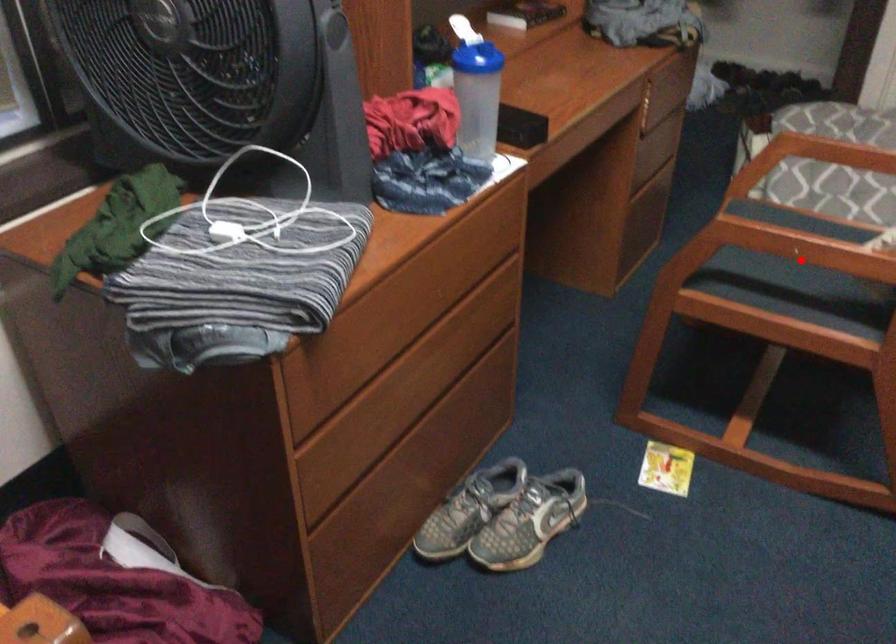
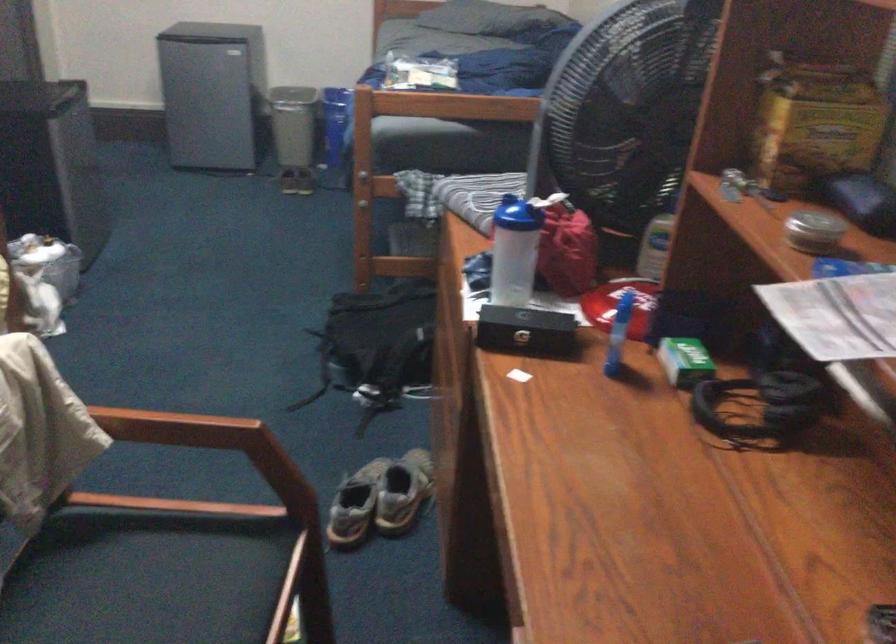
In the second image, find the point that corresponds to the highlighted location in the first image.

(162, 579)